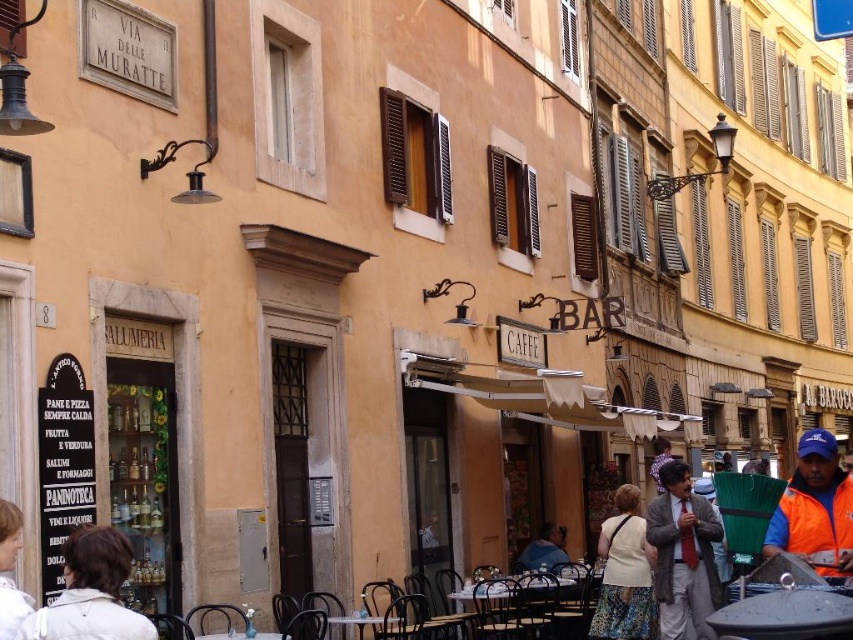
You are a delivery person who needs to place a package at the exact coordinates of the white fabric jacket at lower left. What are the coordinates where you should place the package?

The coordinates for the white fabric jacket at lower left are at point [91,593].

You are a tourist standing in front of the historic building and notice two items of clothing in the scene. The first is a matte gray suit at center, and the second is an orange reflective jacket at lower right. Which item of clothing is taller?

The orange reflective jacket at lower right is taller than the matte gray suit at center.

In the scene shown: You are a tourist standing on the street and see both the white fabric jacket at lower left and the orange reflective jacket at lower right. Which jacket would you estimate to be closer to you based on their sizes?

The white fabric jacket at lower left is smaller than the orange reflective jacket at lower right, so the orange reflective jacket at lower right is closer to you because closer objects appear larger.